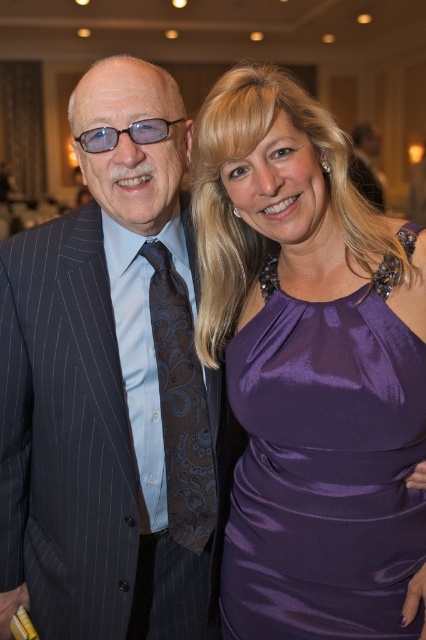
Question: Which point is closer to the camera taking this photo?

Choices:
 (A) (362, 122)
 (B) (330, 557)
 (C) (154, 285)
 (D) (160, 136)

Answer: (B)

Question: Is satin purple dress at right closer to camera compared to matte black suit at left?

Choices:
 (A) yes
 (B) no

Answer: (A)

Question: Which object appears farthest from the camera in this image?

Choices:
 (A) brown paisley tie at left
 (B) satin purple dress at right

Answer: (A)

Question: Is brown paisley tie at left positioned before clear plastic glasses at upper left?

Choices:
 (A) no
 (B) yes

Answer: (A)

Question: Which object appears farthest from the camera in this image?

Choices:
 (A) clear plastic glasses at upper left
 (B) dark pinstripe suit at center
 (C) brown paisley tie at left

Answer: (C)

Question: Does matte black suit at left have a greater width compared to clear plastic glasses at upper left?

Choices:
 (A) no
 (B) yes

Answer: (B)